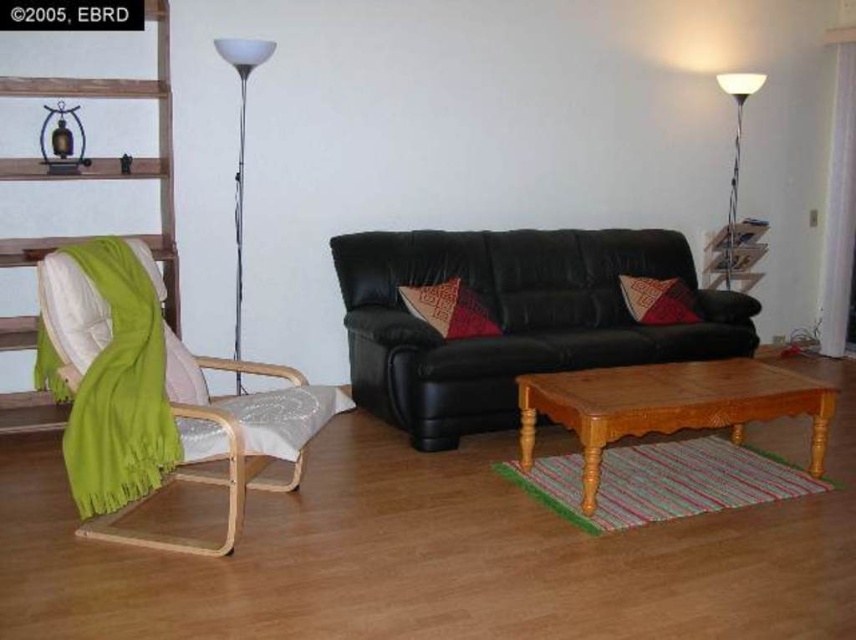
You are standing in the living room and want to place a small plant on the floor next to the green fabric chair at left. What are the coordinates where you should place it?

The coordinates for placing the small plant next to the green fabric chair at left are approximately 0.245 in the x and 0.133 in the y direction.

You are sitting on the sofa and want to reach the metallic silver floor lamp at left and the red woven pillow at center. Which object is higher from the floor?

The metallic silver floor lamp at left is higher from the floor than the red woven pillow at center.